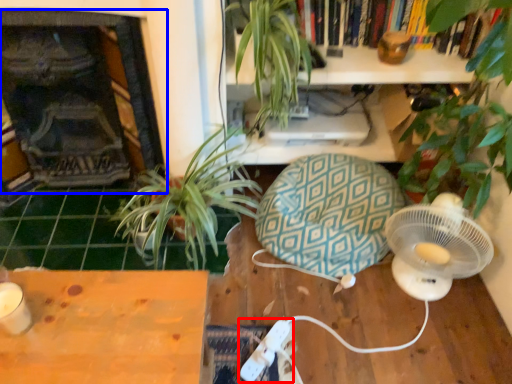
Question: Which object appears farthest to the camera in this image, Wii controller (highlighted by a red box) or fireplace (highlighted by a blue box)?

Choices:
 (A) Wii controller
 (B) fireplace

Answer: (A)